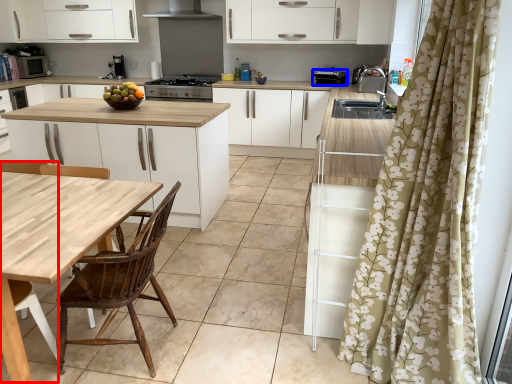
Question: Among these objects, which one is farthest to the camera, chair (highlighted by a red box) or appliance (highlighted by a blue box)?

Choices:
 (A) chair
 (B) appliance

Answer: (B)